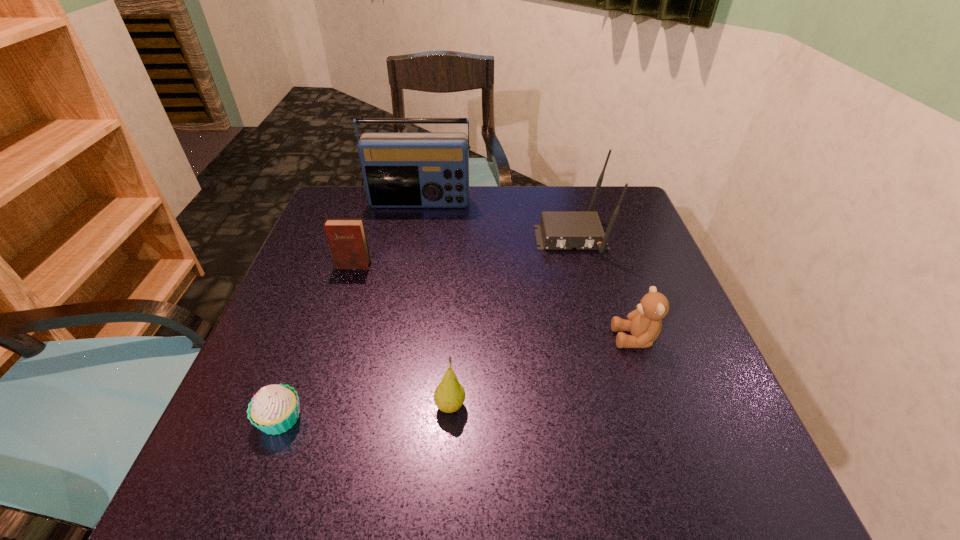
Find the location of a particular element. cupcake at the left edge is located at coordinates (274, 409).

This screenshot has width=960, height=540. What are the coordinates of `router that is at the right edge` in the screenshot? It's located at (557, 230).

The width and height of the screenshot is (960, 540). I want to click on teddy bear at the right edge, so click(644, 324).

This screenshot has width=960, height=540. Identify the location of object that is at the far left corner. (400, 169).

I want to click on object that is at the far right corner, so click(x=557, y=230).

In the image, there is a desktop. Where is `vacant region at the far edge`? This screenshot has width=960, height=540. vacant region at the far edge is located at coordinates (412, 214).

At what (x,y) coordinates should I click in order to perform the action: click on free space at the near edge of the desktop. Please return your answer as a coordinate pair (x, y). Looking at the image, I should click on (454, 457).

What are the coordinates of `vacant region at the left edge` in the screenshot? It's located at (324, 335).

The image size is (960, 540). I want to click on vacant space at the right edge, so click(686, 317).

Where is `vacant space at the far left corner of the desktop`? Image resolution: width=960 pixels, height=540 pixels. vacant space at the far left corner of the desktop is located at coordinates (317, 233).